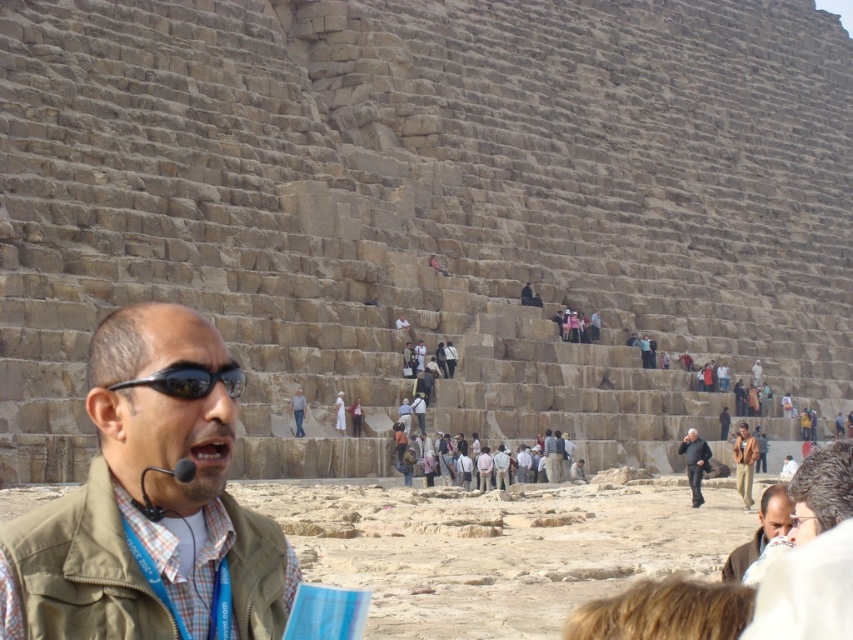
Question: Is black reflective sunglasses at center thinner than smooth beige shirt at lower right?

Choices:
 (A) no
 (B) yes

Answer: (B)

Question: Is black reflective sunglasses at center in front of smooth beige shirt at lower right?

Choices:
 (A) yes
 (B) no

Answer: (A)

Question: Which of the following is the closest to the observer?

Choices:
 (A) green fabric vest at center
 (B) brown leather jacket at lower right

Answer: (A)

Question: In this image, where is light brown stone people at center located relative to black reflective sunglasses at center?

Choices:
 (A) right
 (B) left

Answer: (A)

Question: Based on their relative distances, which object is farther from the light brown stone people at center?

Choices:
 (A) green fabric vest at center
 (B) brown leather jacket at lower right
 (C) dark brown leather jacket at center
 (D) smooth beige shirt at lower right

Answer: (A)

Question: Which object is the closest to the brown leather jacket at lower right?

Choices:
 (A) smooth beige shirt at lower right
 (B) dark brown leather jacket at center

Answer: (B)